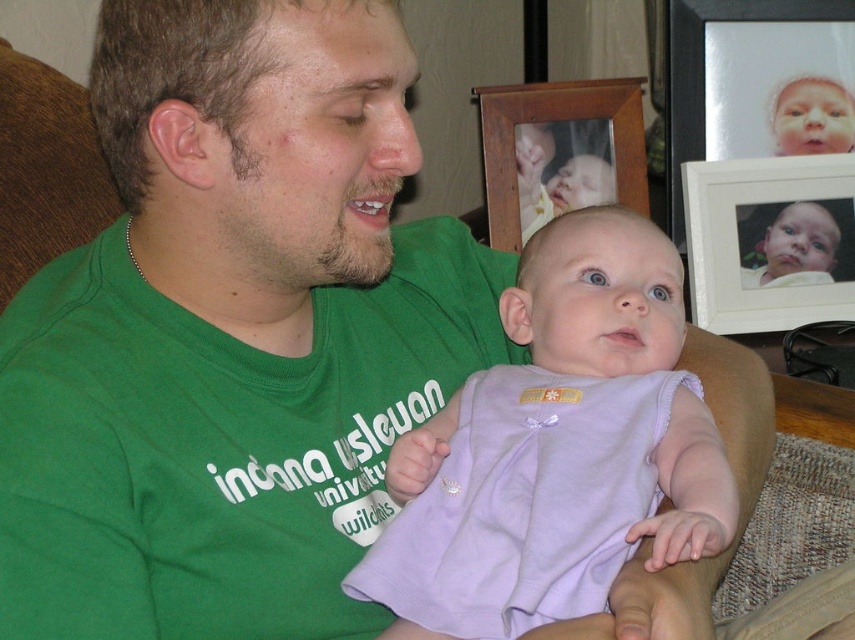
You are an interior designer assessing the placement of items in this room. Considering the lavender fabric baby at center and the wooden picture frame at upper center, which object is taller?

The lavender fabric baby at center is taller than the wooden picture frame at upper center.

In the image, there is an adult wearing a green tshirt with white text and a baby dressed in a light purple sleeveless outfit with a small bow detail. The adult is holding the baby at the center of the image. There is also a wooden chair with a textured fabric and two framed photographs in the background. One of the frames has a closeup of a baby face. Now, the point at coordinates [557,449] is marked. Which object from the following list is located at that point? The options are the adult, the baby, the

The point at coordinates [557,449] marks the lavender fabric baby at center.